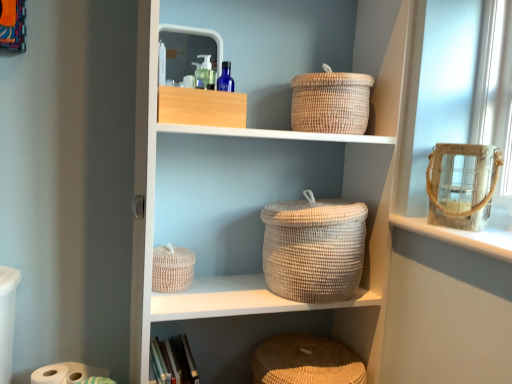
What do you see at coordinates (258, 211) in the screenshot? I see `natural woven baskets at center` at bounding box center [258, 211].

Measure the distance between natural woven basket at center, the second basket when ordered from bottom to top, and camera.

They are 1.15 meters apart.

Locate an element on the screen. The width and height of the screenshot is (512, 384). natural woven basket at center, the 2th basket when ordered from top to bottom is located at coordinates (172, 269).

Identify the location of orange fabric picture frame at upper left. The width and height of the screenshot is (512, 384). (13, 25).

The height and width of the screenshot is (384, 512). What are the coordinates of `white matte toilet paper at lower left` in the screenshot? It's located at (66, 373).

Identify the location of natural woven basket at lower center, which appears as the 3th basket when viewed from the top. (306, 361).

The image size is (512, 384). What do you see at coordinates (306, 361) in the screenshot? I see `natural woven basket at lower center, which appears as the 3th basket when viewed from the top` at bounding box center [306, 361].

Where is `natural woven baskets at center`? This screenshot has height=384, width=512. natural woven baskets at center is located at coordinates (258, 211).

Is white matte toilet paper at lower left positioned with its back to natural woven baskets at center?

No, white matte toilet paper at lower left is not facing away from natural woven baskets at center.

Considering the relative sizes of white matte toilet paper at lower left and natural woven baskets at center in the image provided, is white matte toilet paper at lower left bigger than natural woven baskets at center?

Actually, white matte toilet paper at lower left might be smaller than natural woven baskets at center.

From the image's perspective, who appears lower, white matte toilet paper at lower left or natural woven baskets at center?

From the image's view, white matte toilet paper at lower left is below.

Would you say white matte toilet paper at lower left is a long distance from natural woven baskets at center?

Actually, white matte toilet paper at lower left and natural woven baskets at center are a little close together.

From a real-world perspective, is white matte toilet paper at lower left beneath natural woven basket at lower center, which appears as the 3th basket when viewed from the top?

No, from a real-world perspective, white matte toilet paper at lower left is not under natural woven basket at lower center, which appears as the 3th basket when viewed from the top.

Is natural woven basket at lower center, the 1th basket in the bottom-to-top sequence, located within white matte toilet paper at lower left?

No, natural woven basket at lower center, the 1th basket in the bottom-to-top sequence, is not surrounded by white matte toilet paper at lower left.

Which of these two, white matte toilet paper at lower left or natural woven basket at lower center, which appears as the 3th basket when viewed from the top, is smaller?

With smaller size is white matte toilet paper at lower left.

Does white matte toilet paper at lower left have a greater width compared to natural woven basket at lower center, which appears as the 3th basket when viewed from the top?

Incorrect, the width of white matte toilet paper at lower left does not surpass that of natural woven basket at lower center, which appears as the 3th basket when viewed from the top.

Consider the image. Considering the sizes of objects natural woven baskets at center and white woven basket at center in the image provided, who is thinner, natural woven baskets at center or white woven basket at center?

white woven basket at center is thinner.

From the image's perspective, is natural woven baskets at center located above or below white woven basket at center?

Based on their image positions, natural woven baskets at center is located above white woven basket at center.

Would you say natural woven baskets at center is inside or outside white woven basket at center?

natural woven baskets at center is located beyond the bounds of white woven basket at center.

Does natural woven baskets at center touch white woven basket at center?

No, natural woven baskets at center is not making contact with white woven basket at center.

Between natural woven basket at upper center, the 3th basket in the bottom-to-top sequence, and orange fabric picture frame at upper left, which one has larger width?

With larger width is natural woven basket at upper center, the 3th basket in the bottom-to-top sequence.

Can you confirm if natural woven basket at upper center, the 1th basket viewed from the top, is smaller than orange fabric picture frame at upper left?

No, natural woven basket at upper center, the 1th basket viewed from the top, is not smaller than orange fabric picture frame at upper left.

Is natural woven basket at upper center, the 1th basket viewed from the top, oriented towards orange fabric picture frame at upper left?

No.

I want to click on basket that is the 1st object located below the orange fabric picture frame at upper left (from the image's perspective), so click(331, 102).

Can you confirm if natural woven baskets at center is wider than natural woven basket at center, the second basket when ordered from bottom to top?

Yes, natural woven baskets at center is wider than natural woven basket at center, the second basket when ordered from bottom to top.

Consider the image. Is natural woven basket at center, the second basket when ordered from bottom to top, a part of natural woven baskets at center?

That's correct, natural woven basket at center, the second basket when ordered from bottom to top, is inside natural woven baskets at center.

Is natural woven baskets at center to the left or to the right of natural woven basket at center, the second basket when ordered from bottom to top, in the image?

Clearly, natural woven baskets at center is on the right of natural woven basket at center, the second basket when ordered from bottom to top, in the image.

From a real-world perspective, which basket is the 1st one underneath the natural woven baskets at center? Please provide its 2D coordinates.

[(172, 269)]

Does natural woven basket at lower center, the 1th basket in the bottom-to-top sequence, have a smaller size compared to natural woven basket at center, the 2th basket when ordered from top to bottom?

No, natural woven basket at lower center, the 1th basket in the bottom-to-top sequence, is not smaller than natural woven basket at center, the 2th basket when ordered from top to bottom.

Is natural woven basket at lower center, which appears as the 3th basket when viewed from the top, with natural woven basket at center, the 2th basket when ordered from top to bottom?

No, natural woven basket at lower center, which appears as the 3th basket when viewed from the top, is not in contact with natural woven basket at center, the 2th basket when ordered from top to bottom.

From a real-world perspective, does natural woven basket at lower center, which appears as the 3th basket when viewed from the top, stand above natural woven basket at center, the 2th basket when ordered from top to bottom?

No, from a real-world perspective, natural woven basket at lower center, which appears as the 3th basket when viewed from the top, is not on top of natural woven basket at center, the 2th basket when ordered from top to bottom.

How many degrees apart are the facing directions of natural woven basket at center, the second basket when ordered from bottom to top, and natural woven basket at lower center, which appears as the 3th basket when viewed from the top?

The angular difference between natural woven basket at center, the second basket when ordered from bottom to top, and natural woven basket at lower center, which appears as the 3th basket when viewed from the top, is 1.27 degrees.

Find the location of a particular element. basket beneath the natural woven basket at center, the second basket when ordered from bottom to top (from a real-world perspective) is located at coordinates (306, 361).

Is natural woven basket at center, the second basket when ordered from bottom to top, outside of natural woven basket at lower center, which appears as the 3th basket when viewed from the top?

natural woven basket at center, the second basket when ordered from bottom to top, lies outside natural woven basket at lower center, which appears as the 3th basket when viewed from the top,'s area.

From the image's perspective, between natural woven basket at center, the second basket when ordered from bottom to top, and natural woven basket at lower center, the 1th basket in the bottom-to-top sequence, who is located below?

natural woven basket at lower center, the 1th basket in the bottom-to-top sequence.

Find the location of `shelf above the white matte toilet paper at lower left (from the image's perspective)`. shelf above the white matte toilet paper at lower left (from the image's perspective) is located at coordinates (258, 211).

Where is `the 2nd basket to the right of the white matte toilet paper at lower left, starting your count from the anchor`? The height and width of the screenshot is (384, 512). the 2nd basket to the right of the white matte toilet paper at lower left, starting your count from the anchor is located at coordinates (306, 361).

Considering their positions, is white woven basket at center positioned closer to natural woven basket at center, the 2th basket when ordered from top to bottom, than white matte toilet paper at lower left?

The object closer to natural woven basket at center, the 2th basket when ordered from top to bottom, is white woven basket at center.

Based on their spatial positions, is white woven basket at center or natural woven baskets at center further from natural woven basket at lower center, which appears as the 3th basket when viewed from the top?

The object further to natural woven basket at lower center, which appears as the 3th basket when viewed from the top, is natural woven baskets at center.

Estimate the real-world distances between objects in this image. Which object is further from natural woven basket at lower center, which appears as the 3th basket when viewed from the top, natural woven basket at center, the second basket when ordered from bottom to top, or natural woven basket at upper center, the 1th basket viewed from the top?

The object further to natural woven basket at lower center, which appears as the 3th basket when viewed from the top, is natural woven basket at upper center, the 1th basket viewed from the top.

Estimate the real-world distances between objects in this image. Which object is closer to natural woven basket at upper center, the 3th basket in the bottom-to-top sequence, natural woven baskets at center or white woven basket at center?

Among the two, white woven basket at center is located nearer to natural woven basket at upper center, the 3th basket in the bottom-to-top sequence.

Based on their spatial positions, is natural woven basket at center, the second basket when ordered from bottom to top, or white woven basket at center further from orange fabric picture frame at upper left?

white woven basket at center.

From the image, which object appears to be nearer to orange fabric picture frame at upper left, natural woven baskets at center or natural woven basket at center, the second basket when ordered from bottom to top?

natural woven basket at center, the second basket when ordered from bottom to top, lies closer to orange fabric picture frame at upper left than the other object.

Estimate the real-world distances between objects in this image. Which object is closer to white woven basket at center, natural woven baskets at center or natural woven basket at lower center, the 1th basket in the bottom-to-top sequence?

The object closer to white woven basket at center is natural woven baskets at center.

Looking at the image, which one is located further to white matte toilet paper at lower left, natural woven baskets at center or white woven basket at center?

white woven basket at center is positioned further to the anchor white matte toilet paper at lower left.

The width and height of the screenshot is (512, 384). Find the location of `toilet paper that lies between natural woven basket at upper center, the 3th basket in the bottom-to-top sequence, and natural woven basket at lower center, which appears as the 3th basket when viewed from the top, from top to bottom`. toilet paper that lies between natural woven basket at upper center, the 3th basket in the bottom-to-top sequence, and natural woven basket at lower center, which appears as the 3th basket when viewed from the top, from top to bottom is located at coordinates (66, 373).

You are a GUI agent. You are given a task and a screenshot of the screen. Output one action in this format:
    pyautogui.click(x=<x>, y=<y>)
    Task: Click on the shelf between orange fabric picture frame at upper left and white matte toilet paper at lower left vertically
    The height and width of the screenshot is (384, 512).
    Given the screenshot: What is the action you would take?
    pyautogui.click(x=258, y=211)

Locate an element on the screen. basket container between orange fabric picture frame at upper left and natural woven basket at upper center, the 3th basket in the bottom-to-top sequence, in the horizontal direction is located at coordinates (314, 249).

Locate an element on the screen. This screenshot has height=384, width=512. basket container that lies between natural woven basket at upper center, the 1th basket viewed from the top, and natural woven basket at center, the second basket when ordered from bottom to top, from top to bottom is located at coordinates (314, 249).